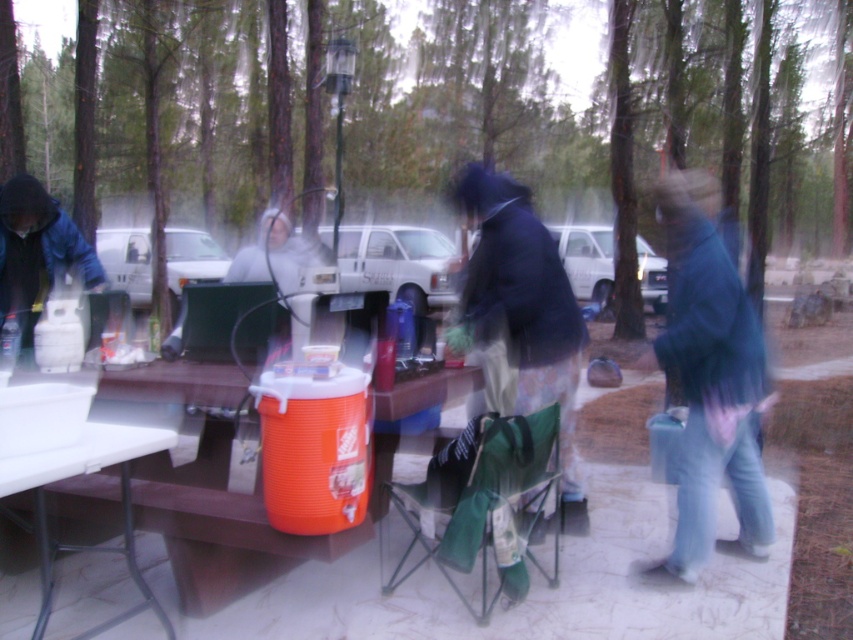
You are standing at the picnic table and want to hand a snack to both the blue fuzzy jacket at right and the dark blue jacket at center. Which person would you need to reach down lower to give the snack to?

You would need to reach down lower to give the snack to the blue fuzzy jacket at right because it has a lesser height compared to the dark blue jacket at center.

In the scene shown: You are standing at the picnic table and want to pick up an item. There are two points marked on the table surface. Which point is closer to you, point (706,480) or point (561,492)?

Point (706,480) is closer to the camera than point (561,492).